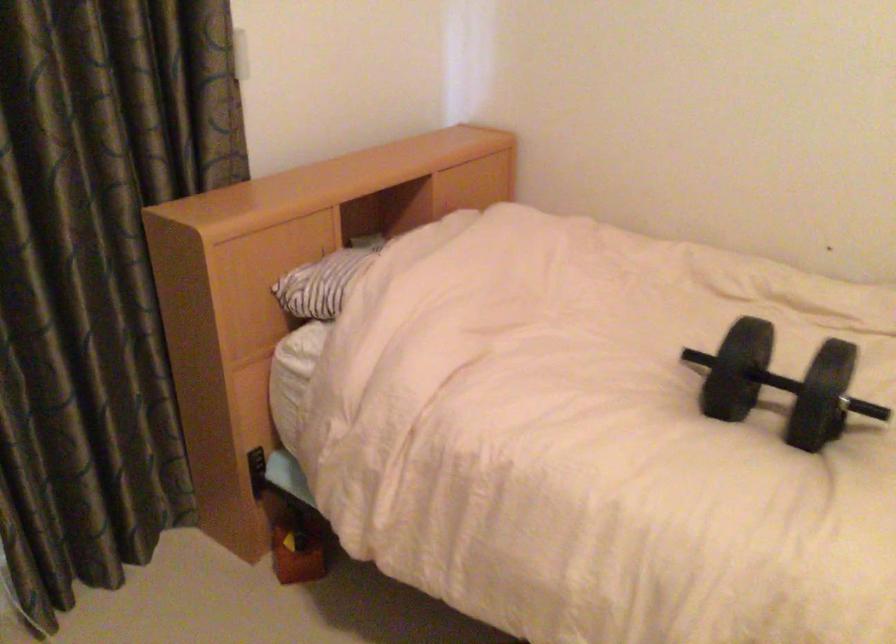
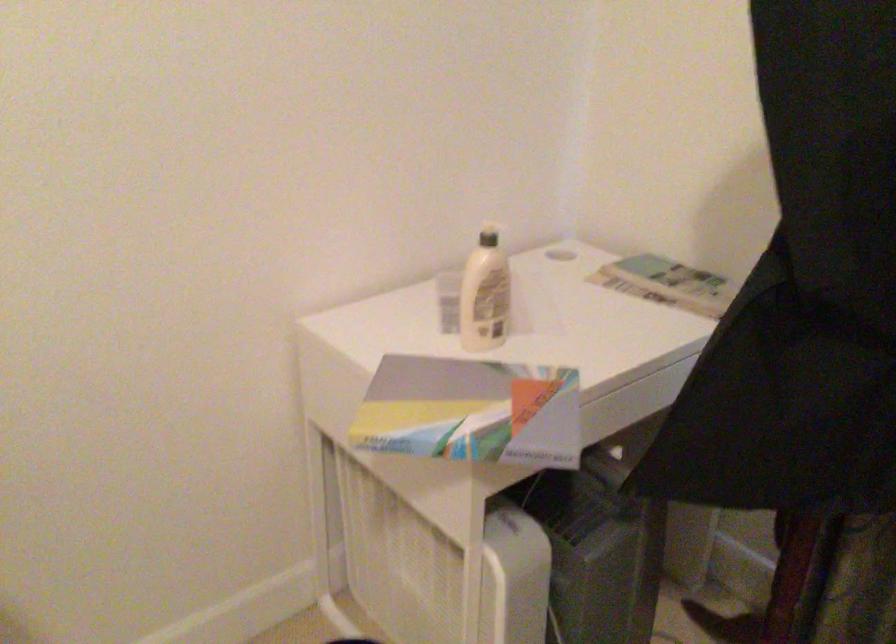
The first image is from the beginning of the video and the second image is from the end. How did the camera likely rotate when shooting the video?

The camera's rotation is toward left-down.